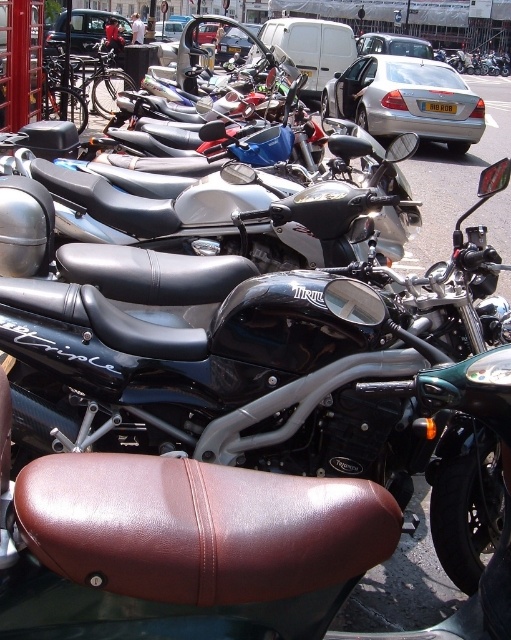
Question: Does black leather seat at center have a greater width compared to silver metallic sedan at center?

Choices:
 (A) no
 (B) yes

Answer: (A)

Question: Based on their relative distances, which object is farther from the metallic silver car at center?

Choices:
 (A) silver metallic sedan at upper center
 (B) black leather seat at center

Answer: (B)

Question: Which object is the closest to the metallic silver car at center?

Choices:
 (A) silver metallic sedan at center
 (B) black leather seat at center

Answer: (A)

Question: Does silver metallic sedan at center have a lesser width compared to silver metallic sedan at upper center?

Choices:
 (A) no
 (B) yes

Answer: (B)

Question: Which of the following is the closest to the observer?

Choices:
 (A) silver metallic sedan at upper center
 (B) black leather seat at center
 (C) metallic silver car at center
 (D) silver metallic sedan at center

Answer: (B)

Question: Is the position of silver metallic sedan at center more distant than that of metallic silver car at center?

Choices:
 (A) no
 (B) yes

Answer: (A)